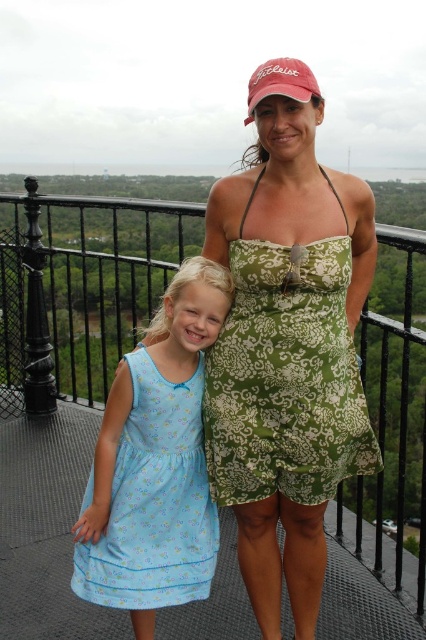
Does black metal railing at upper center appear over light blue fabric dress at left?

Yes, black metal railing at upper center is above light blue fabric dress at left.

Is point (100, 349) behind point (187, 467)?

Yes, point (100, 349) is farther from viewer.

Is point (389, 588) farther from viewer compared to point (135, 355)?

Yes, it is behind point (135, 355).

Where is `black metal railing at upper center`? black metal railing at upper center is located at coordinates (81, 284).

Is point (256, 93) more distant than point (166, 572)?

No.

Is the position of green printed dress at center more distant than that of light blue fabric dress at left?

Yes.

Locate an element on the screen. green printed dress at center is located at coordinates (287, 346).

Can you confirm if green printed dress at center is bigger than black metal railing at upper center?

Actually, green printed dress at center might be smaller than black metal railing at upper center.

Can you confirm if green printed dress at center is positioned to the right of black metal railing at upper center?

Correct, you'll find green printed dress at center to the right of black metal railing at upper center.

Image resolution: width=426 pixels, height=640 pixels. What are the coordinates of `green printed dress at center` in the screenshot? It's located at pos(287,346).

I want to click on green printed dress at center, so click(287, 346).